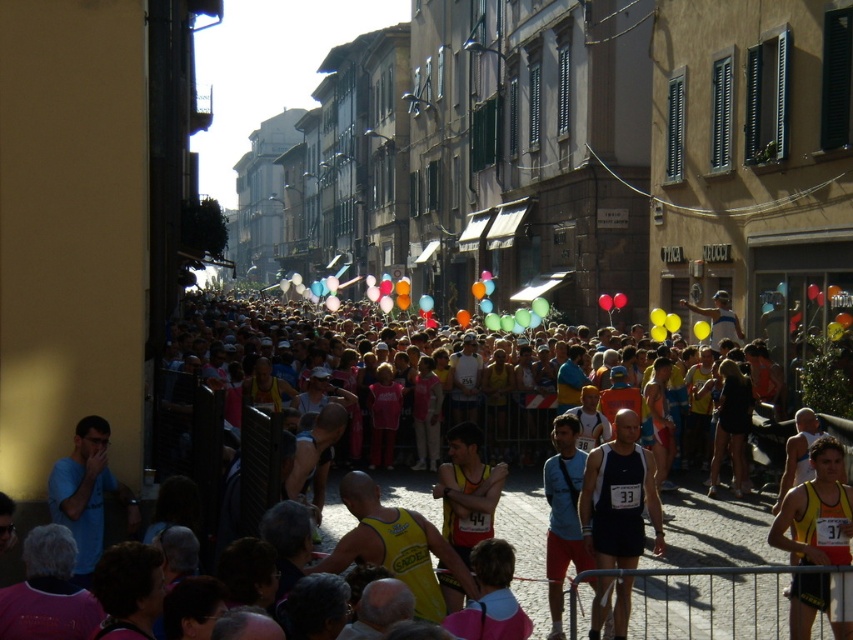
Question: Is dark blue athletic tank top at center wider than yellow fabric tank top at center?

Choices:
 (A) no
 (B) yes

Answer: (A)

Question: Is dark blue athletic tank top at center in front of yellow fabric tank top at center?

Choices:
 (A) no
 (B) yes

Answer: (A)

Question: Among these objects, which one is nearest to the camera?

Choices:
 (A) dark blue athletic tank top at center
 (B) yellow fabric tank top at center

Answer: (B)

Question: Does dark blue athletic tank top at center appear on the left side of yellow fabric tank top at center?

Choices:
 (A) no
 (B) yes

Answer: (B)

Question: Which point is farther to the camera?

Choices:
 (A) dark blue athletic tank top at center
 (B) yellow fabric tank top at center

Answer: (A)